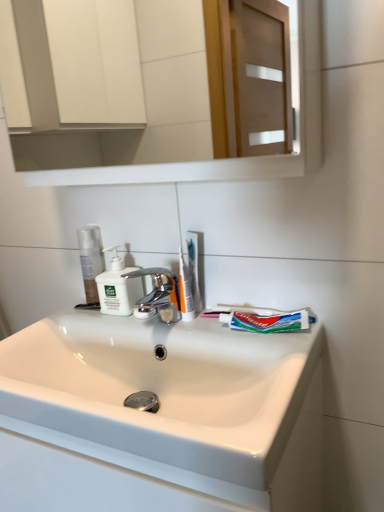
The image size is (384, 512). I want to click on blank space to the left of translucent plastic toothbrush at center, so click(140, 320).